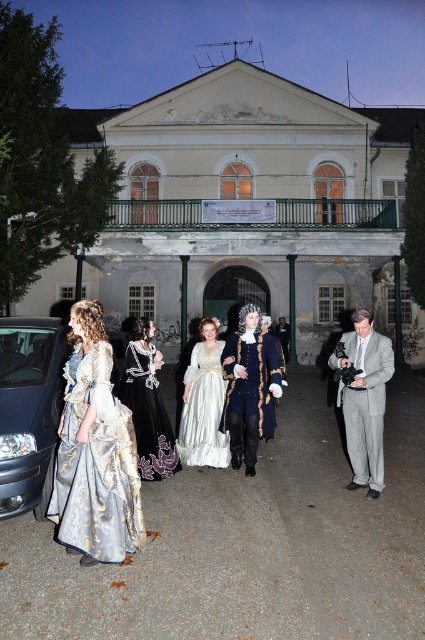
Question: Which of the following is the closest to the observer?

Choices:
 (A) black satin gown at center
 (B) shiny black car at left

Answer: (B)

Question: Which of the following is the closest to the observer?

Choices:
 (A) black satin gown at center
 (B) white satin gown at center
 (C) silk blue coat at center
 (D) silk satin dresses at center

Answer: (D)

Question: Considering the relative positions of silvery brocade gown at center and gray fabric suit at right in the image provided, where is silvery brocade gown at center located with respect to gray fabric suit at right?

Choices:
 (A) right
 (B) left

Answer: (B)

Question: Which object is closer to the camera taking this photo?

Choices:
 (A) silk blue coat at center
 (B) silk satin dresses at center

Answer: (B)

Question: Is shiny black car at left wider than silk gold dress at center?

Choices:
 (A) yes
 (B) no

Answer: (A)

Question: Does silvery brocade gown at center come behind white satin gown at center?

Choices:
 (A) no
 (B) yes

Answer: (A)